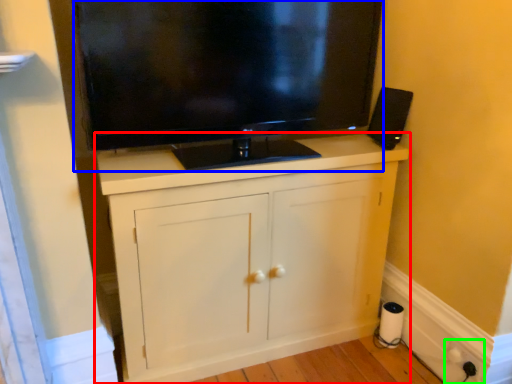
Question: Considering the real-world distances, which object is farthest from cabinetry (highlighted by a red box)? television (highlighted by a blue box) or electric outlet (highlighted by a green box)?

Choices:
 (A) television
 (B) electric outlet

Answer: (B)